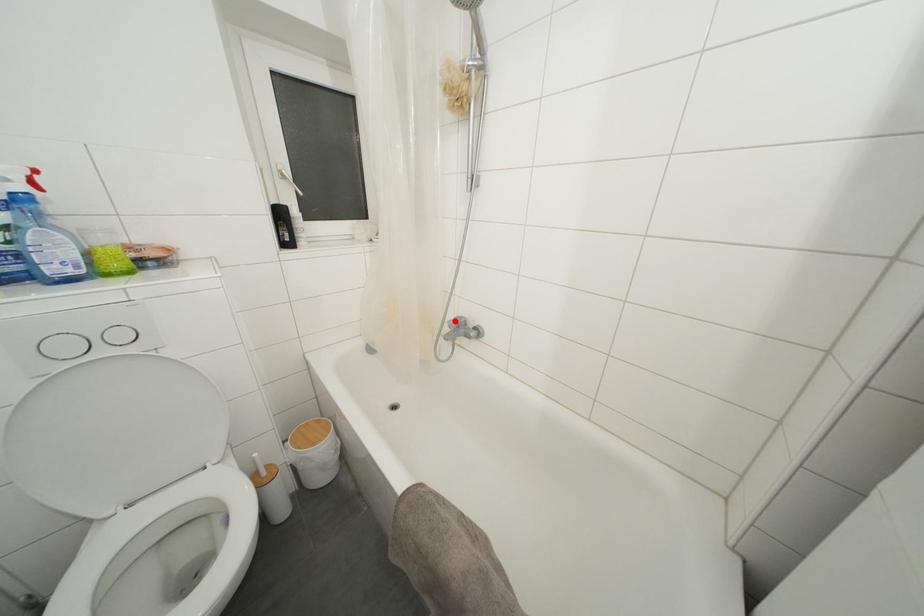
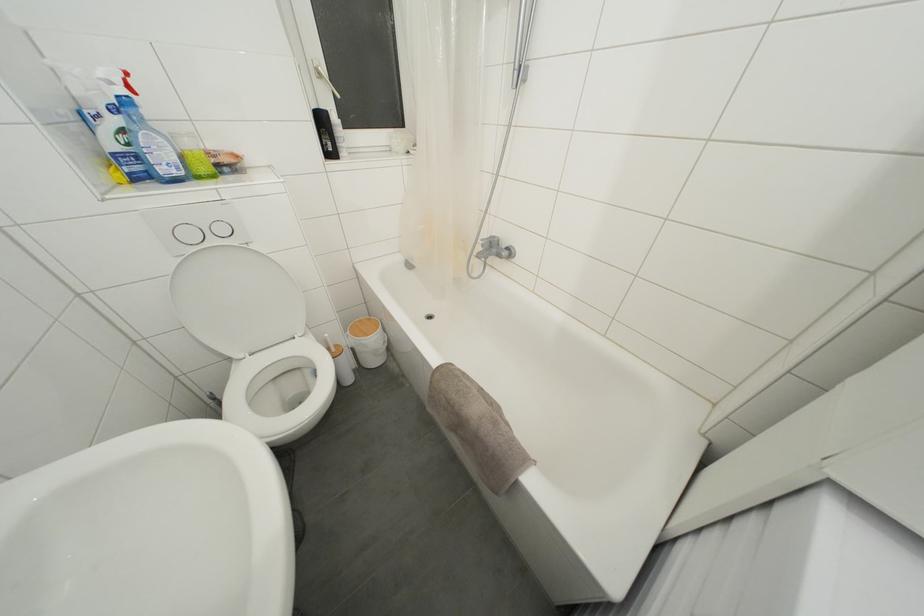
Question: I am providing you with two images of the same scene from different viewpoints. A red point is marked on the first image. At the location where the point appears in image 1, is it still visible in image 2?

Choices:
 (A) Yes
 (B) No

Answer: (A)